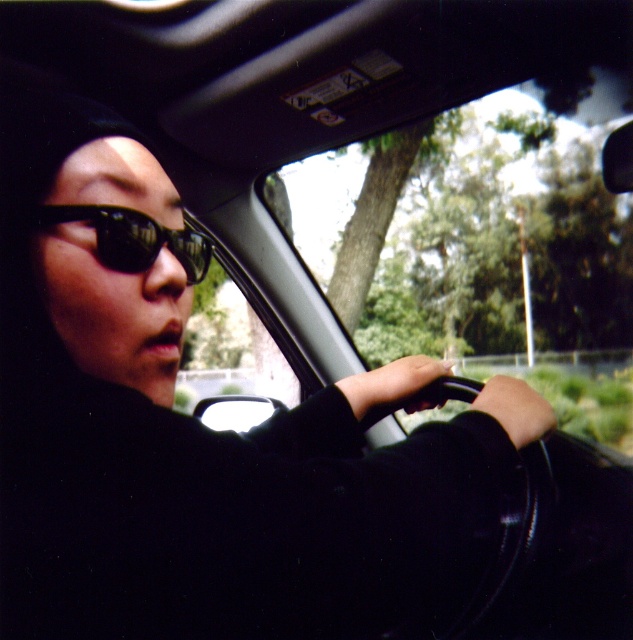
Question: Which of the following is the closest to the observer?

Choices:
 (A) (49, 218)
 (B) (327, 156)

Answer: (A)

Question: Can you confirm if transparent glass car window at center is wider than black reflective sunglasses at center?

Choices:
 (A) no
 (B) yes

Answer: (B)

Question: Which object is closer to the camera taking this photo?

Choices:
 (A) transparent glass car window at center
 (B) black reflective sunglasses at center

Answer: (B)

Question: Which of the following is the closest to the observer?

Choices:
 (A) (627, 324)
 (B) (47, 212)

Answer: (B)

Question: Is transparent glass car window at center below black reflective sunglasses at center?

Choices:
 (A) no
 (B) yes

Answer: (A)

Question: Can you confirm if transparent glass car window at center is positioned below black reflective sunglasses at center?

Choices:
 (A) no
 (B) yes

Answer: (A)